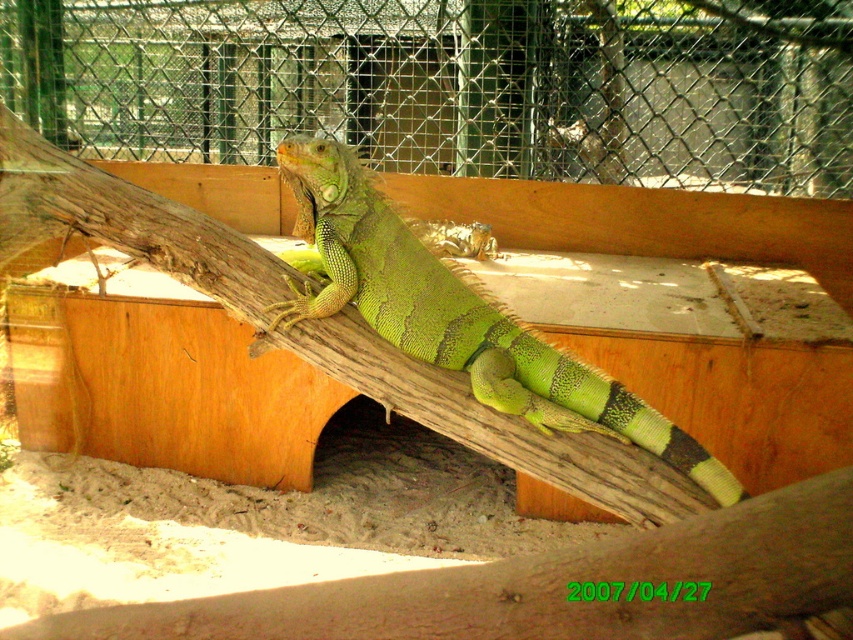
You are a zookeeper who needs to clean the enclosure where the green iguana is resting. You have a long pole that can reach up to 5 meters. Can you safely clean the green mesh fence at upper center using your pole?

The green mesh fence at upper center is 5.34 meters away from the camera, which is beyond the 5 meter reach of the pole. Therefore, the zookeeper cannot safely clean the green mesh fence at upper center with the current pole.

You are a zookeeper checking the enclosure. You need to reach the green scaly lizard at center to feed it. The green mesh fence at upper center is in your way. Can you walk around the fence to get to the lizard?

The green scaly lizard at center is behind the green mesh fence at upper center, so you cannot directly access it by walking around the fence. You may need to use a feeding tool or access the enclosure through another entrance.

You are a zookeeper who needs to ensure the green scaly lizard at center can move freely within its enclosure. Given that the green mesh fence at upper center has openings, can the lizard pass through the fence if it tries to climb over?

The green mesh fence at upper center is wider than the green scaly lizard at center, so the lizard can pass through the fence if it tries to climb over.